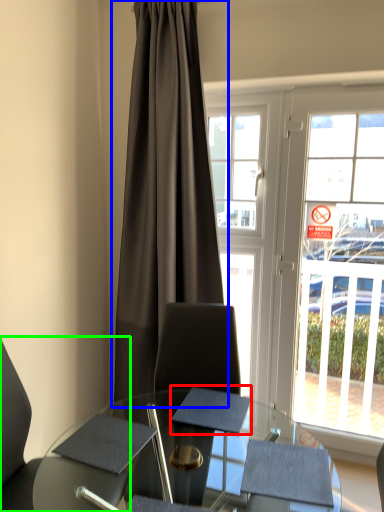
Question: Considering the real-world distances, which object is closest to notepad (highlighted by a red box)? curtain (highlighted by a blue box) or chair (highlighted by a green box).

Choices:
 (A) curtain
 (B) chair

Answer: (B)